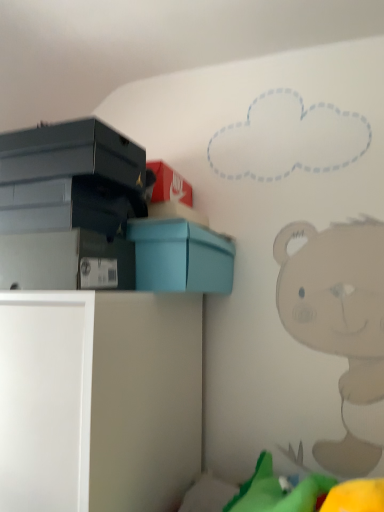
Question: From a real-world perspective, is matte blue box at upper left physically below matte gray storage box at lower left?

Choices:
 (A) yes
 (B) no

Answer: (B)

Question: Can you confirm if matte blue box at upper left is smaller than matte gray storage box at lower left?

Choices:
 (A) yes
 (B) no

Answer: (B)

Question: Is matte blue box at upper left to the left of matte gray storage box at lower left from the viewer's perspective?

Choices:
 (A) no
 (B) yes

Answer: (A)

Question: Can you confirm if matte blue box at upper left is positioned to the right of matte gray storage box at lower left?

Choices:
 (A) no
 (B) yes

Answer: (B)

Question: From a real-world perspective, is matte blue box at upper left on matte gray storage box at lower left?

Choices:
 (A) no
 (B) yes

Answer: (B)

Question: Is matte blue box at upper left inside or outside of matte gray storage box at lower left?

Choices:
 (A) inside
 (B) outside

Answer: (B)

Question: Looking at their shapes, would you say matte blue box at upper left is wider or thinner than matte gray storage box at lower left?

Choices:
 (A) thin
 (B) wide

Answer: (B)

Question: Considering the positions of matte blue box at upper left and matte gray storage box at lower left in the image, is matte blue box at upper left taller or shorter than matte gray storage box at lower left?

Choices:
 (A) short
 (B) tall

Answer: (B)

Question: Does point (173, 242) appear closer or farther from the camera than point (127, 288)?

Choices:
 (A) closer
 (B) farther

Answer: (B)

Question: Considering the relative positions of white matte cabinet at lower left and matte blue box at upper left in the image provided, is white matte cabinet at lower left to the left or to the right of matte blue box at upper left?

Choices:
 (A) left
 (B) right

Answer: (A)

Question: Is white matte cabinet at lower left inside the boundaries of matte blue box at upper left, or outside?

Choices:
 (A) inside
 (B) outside

Answer: (B)

Question: From the image's perspective, is white matte cabinet at lower left located above or below matte blue box at upper left?

Choices:
 (A) above
 (B) below

Answer: (B)

Question: Considering the positions of point pos(200,389) and point pos(231,246), is point pos(200,389) closer or farther from the camera than point pos(231,246)?

Choices:
 (A) closer
 (B) farther

Answer: (A)

Question: Is matte blue box at upper left in front of or behind white matte cabinet at lower left in the image?

Choices:
 (A) front
 (B) behind

Answer: (B)

Question: Is matte blue box at upper left bigger or smaller than white matte cabinet at lower left?

Choices:
 (A) big
 (B) small

Answer: (B)